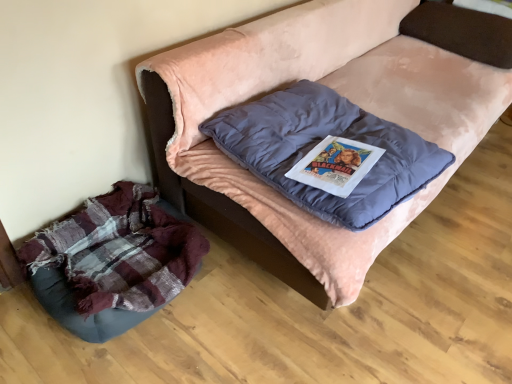
At what (x,y) coordinates should I click in order to perform the action: click on vacant space in front of plaid fabric dog bed at lower left. Please return your answer as a coordinate pair (x, y). The image size is (512, 384). Looking at the image, I should click on (99, 355).